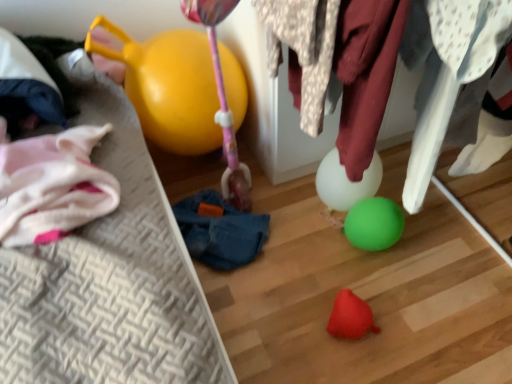
The width and height of the screenshot is (512, 384). I want to click on free spot in front of blue fabric bean bag chair at center, so click(x=260, y=306).